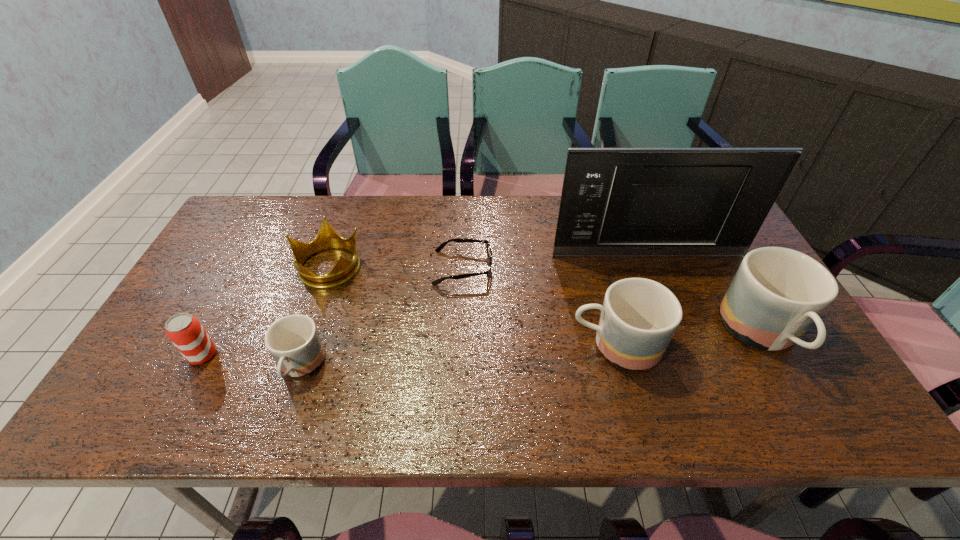
This screenshot has width=960, height=540. Find the location of `free space between the tallest object and the beer can`. free space between the tallest object and the beer can is located at coordinates (425, 305).

You are a GUI agent. You are given a task and a screenshot of the screen. Output one action in this format:
    pyautogui.click(x=<x>, y=<y>)
    Task: Click on the free spot between the rightmost mug and the crown
    
    Given the screenshot: What is the action you would take?
    pyautogui.click(x=545, y=301)

Image resolution: width=960 pixels, height=540 pixels. Find the location of `vacant space that is in between the rightmost mug and the tallest object`. vacant space that is in between the rightmost mug and the tallest object is located at coordinates (705, 295).

The image size is (960, 540). What are the coordinates of `vacant space that is in between the tallest object and the shortest mug` in the screenshot? It's located at pyautogui.click(x=473, y=311).

You are a GUI agent. You are given a task and a screenshot of the screen. Output one action in this format:
    pyautogui.click(x=<x>, y=<y>)
    Task: Click on the vacant area that lies between the second shortest mug and the leftmost object
    Image resolution: width=960 pixels, height=540 pixels.
    Given the screenshot: What is the action you would take?
    pyautogui.click(x=409, y=350)

The width and height of the screenshot is (960, 540). What are the coordinates of `empty space that is in between the shortest mug and the crown` in the screenshot? It's located at (314, 316).

Identify which object is the second nearest to the microwave oven. Please provide its 2D coordinates. Your answer should be formatted as a tuple, i.e. [(x, y)], where the tuple contains the x and y coordinates of a point satisfying the conditions above.

[(459, 240)]

Select which object is the third closest to the second tallest mug. Please provide its 2D coordinates. Your answer should be formatted as a tuple, i.e. [(x, y)], where the tuple contains the x and y coordinates of a point satisfying the conditions above.

[(624, 202)]

Choose which mug is the nearest neighbor to the leftmost mug. Please provide its 2D coordinates. Your answer should be formatted as a tuple, i.e. [(x, y)], where the tuple contains the x and y coordinates of a point satisfying the conditions above.

[(639, 316)]

Locate which mug ranks second in proximity to the beer can. Please provide its 2D coordinates. Your answer should be formatted as a tuple, i.e. [(x, y)], where the tuple contains the x and y coordinates of a point satisfying the conditions above.

[(639, 316)]